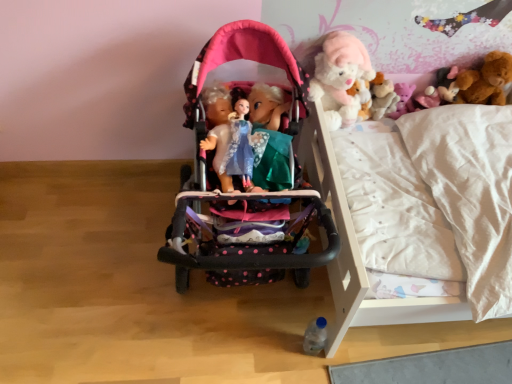
Where is `vacant space to the left of clear plastic bottle at lower center, the fourth toy when ordered from top to bottom`? vacant space to the left of clear plastic bottle at lower center, the fourth toy when ordered from top to bottom is located at coordinates (266, 343).